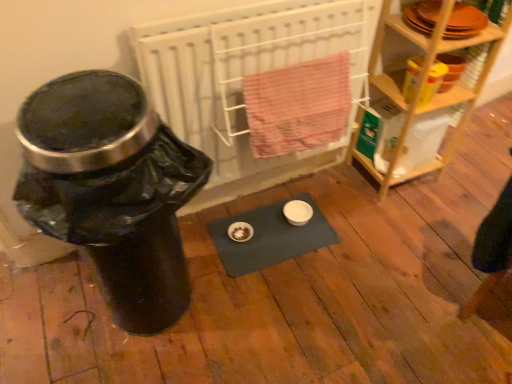
Identify the location of free space underneath black plastic water cooler at left (from a real-world perspective). The width and height of the screenshot is (512, 384). (169, 316).